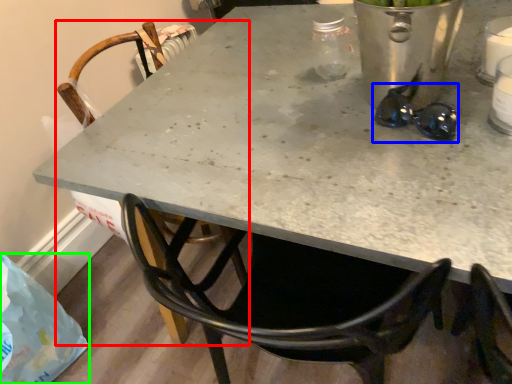
Question: Which is farther away from chair (highlighted by a red box)? glasses (highlighted by a blue box) or plastic bag (highlighted by a green box)?

Choices:
 (A) glasses
 (B) plastic bag

Answer: (A)